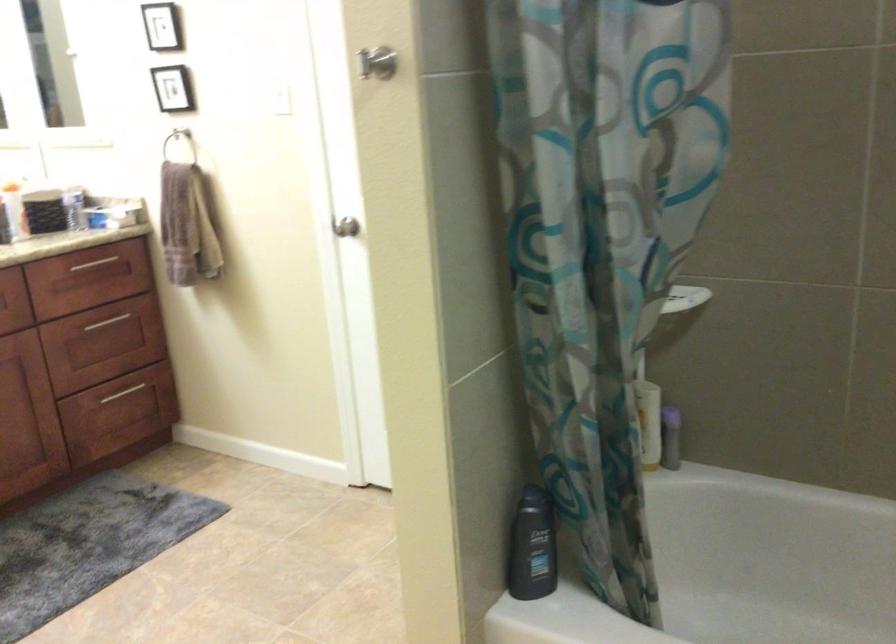
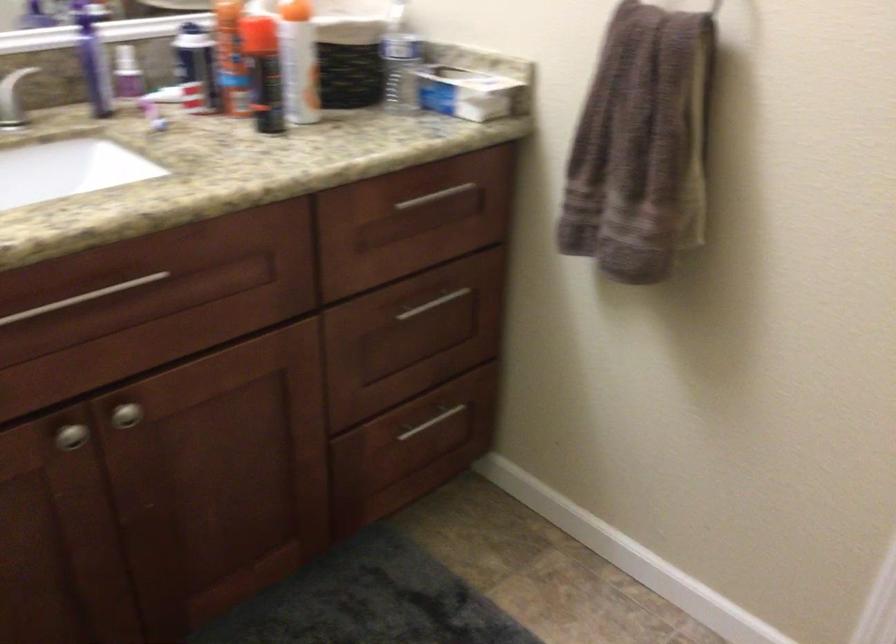
Locate, in the second image, the point that corresponds to pixel 188 219 in the first image.

(641, 146)